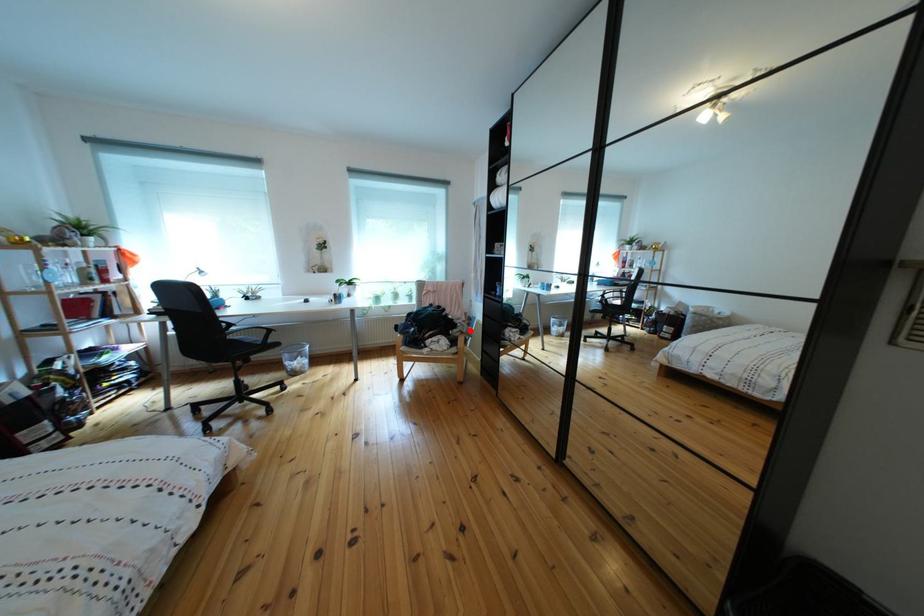
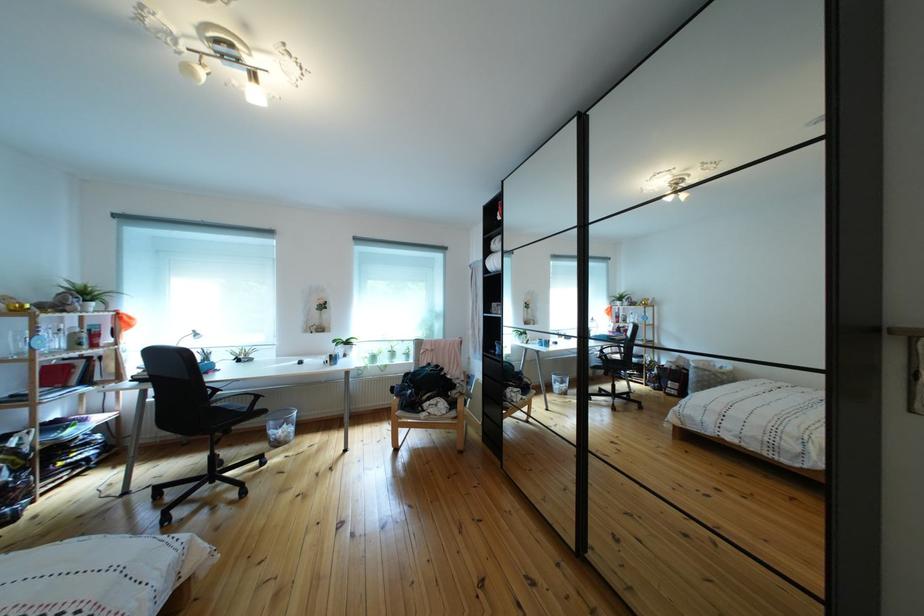
Question: I am providing you with two images of the same scene from different viewpoints. Given a red point in image1, look at the same physical point in image2. Is it:

Choices:
 (A) Closer to the viewpoint
 (B) Farther from the viewpoint

Answer: (B)